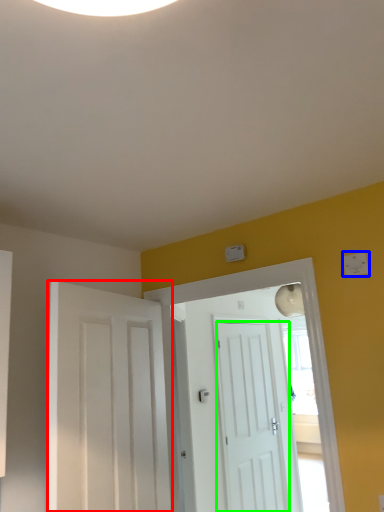
Question: Considering the real-world distances, which object is farthest from door (highlighted by a red box)? light switch (highlighted by a blue box) or door (highlighted by a green box)?

Choices:
 (A) light switch
 (B) door

Answer: (B)